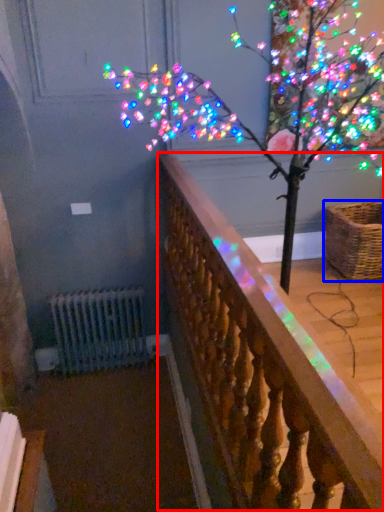
Question: Which point is closer to the camera, rail (highlighted by a red box) or basket (highlighted by a blue box)?

Choices:
 (A) rail
 (B) basket

Answer: (A)